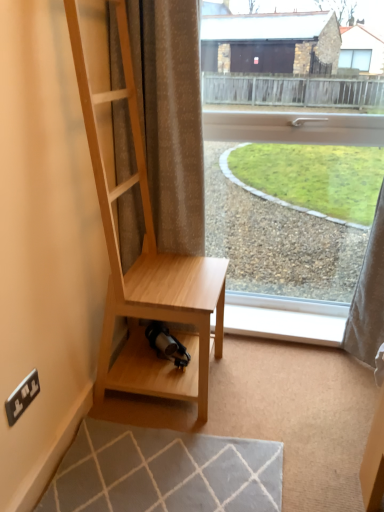
Question: Considering the relative sizes of light wood shelf at center and white plastic electric outlet at lower left in the image provided, is light wood shelf at center taller than white plastic electric outlet at lower left?

Choices:
 (A) yes
 (B) no

Answer: (A)

Question: Is light wood shelf at center at the left side of white plastic electric outlet at lower left?

Choices:
 (A) yes
 (B) no

Answer: (B)

Question: Does light wood shelf at center turn towards white plastic electric outlet at lower left?

Choices:
 (A) no
 (B) yes

Answer: (A)

Question: Is light wood shelf at center smaller than white plastic electric outlet at lower left?

Choices:
 (A) yes
 (B) no

Answer: (B)

Question: Considering the relative positions of light wood shelf at center and white plastic electric outlet at lower left in the image provided, is light wood shelf at center behind white plastic electric outlet at lower left?

Choices:
 (A) no
 (B) yes

Answer: (A)

Question: Looking at the image, does white plastic electric outlet at lower left seem bigger or smaller compared to light wood shelf at center?

Choices:
 (A) big
 (B) small

Answer: (B)

Question: Do you think white plastic electric outlet at lower left is within light wood shelf at center, or outside of it?

Choices:
 (A) inside
 (B) outside

Answer: (B)

Question: Would you say white plastic electric outlet at lower left is to the left or to the right of light wood shelf at center in the picture?

Choices:
 (A) left
 (B) right

Answer: (A)

Question: Does point (21, 401) appear closer or farther from the camera than point (158, 368)?

Choices:
 (A) farther
 (B) closer

Answer: (B)

Question: From the image's perspective, is white plastic window sill at lower center above or below light wood shelf at center?

Choices:
 (A) below
 (B) above

Answer: (A)

Question: Does point (271, 304) appear closer or farther from the camera than point (218, 323)?

Choices:
 (A) farther
 (B) closer

Answer: (A)

Question: Relative to light wood shelf at center, is white plastic window sill at lower center in front or behind?

Choices:
 (A) behind
 (B) front

Answer: (A)

Question: Considering the positions of white plastic window sill at lower center and light wood shelf at center in the image, is white plastic window sill at lower center bigger or smaller than light wood shelf at center?

Choices:
 (A) big
 (B) small

Answer: (B)

Question: Considering the positions of transparent glass window at center and white plastic electric outlet at lower left in the image, is transparent glass window at center bigger or smaller than white plastic electric outlet at lower left?

Choices:
 (A) big
 (B) small

Answer: (A)

Question: From a real-world perspective, is transparent glass window at center physically located above or below white plastic electric outlet at lower left?

Choices:
 (A) below
 (B) above

Answer: (B)